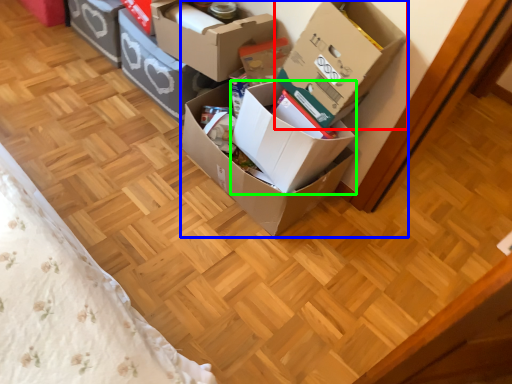
Question: Considering the real-world distances, which object is closest to box (highlighted by a red box)? box (highlighted by a blue box) or box (highlighted by a green box).

Choices:
 (A) box
 (B) box

Answer: (A)